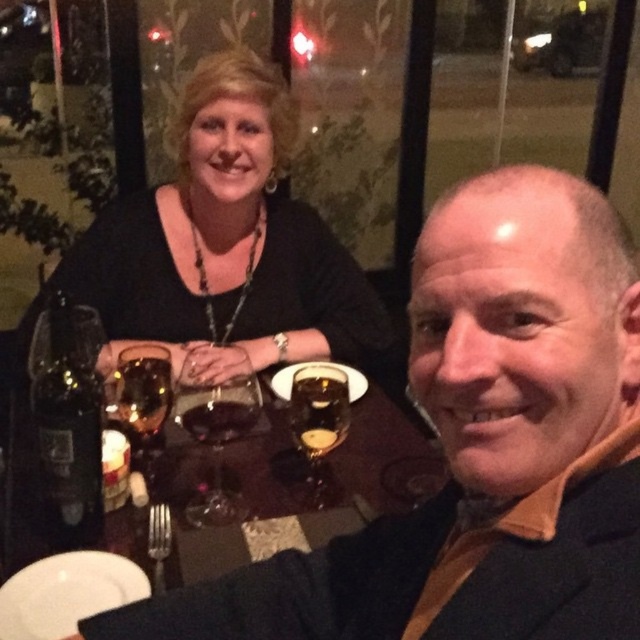
From the picture: You are a waiter in a restaurant. You need to place a new menu on the table without moving any existing items. The menu is 10 cm wide. Is there enough space between the black matte necklace at upper left and the translucent glass at center to place the menu?

The translucent glass at center is behind the black matte necklace at upper left, so there is no space between them on the table. The menu cannot be placed there without moving existing items.

You are a waiter in a restaurant and you need to deliver a dessert to the table where the matte black suit at center and the translucent glass wine at center are located. Which object should you avoid placing the dessert on top of to prevent it from being unstable?

You should avoid placing the dessert on top of the translucent glass wine at center because the matte black suit at center is positioned under it, making the glass less stable there.

You are a waiter at a restaurant and need to place a menu between the black matte necklace at upper left and the translucent glass at center. Which object should you place the menu closer to to ensure it doesn

The black matte necklace at upper left is much taller than the translucent glass at center, so placing the menu closer to the translucent glass at center would ensure it stays stable and doesn